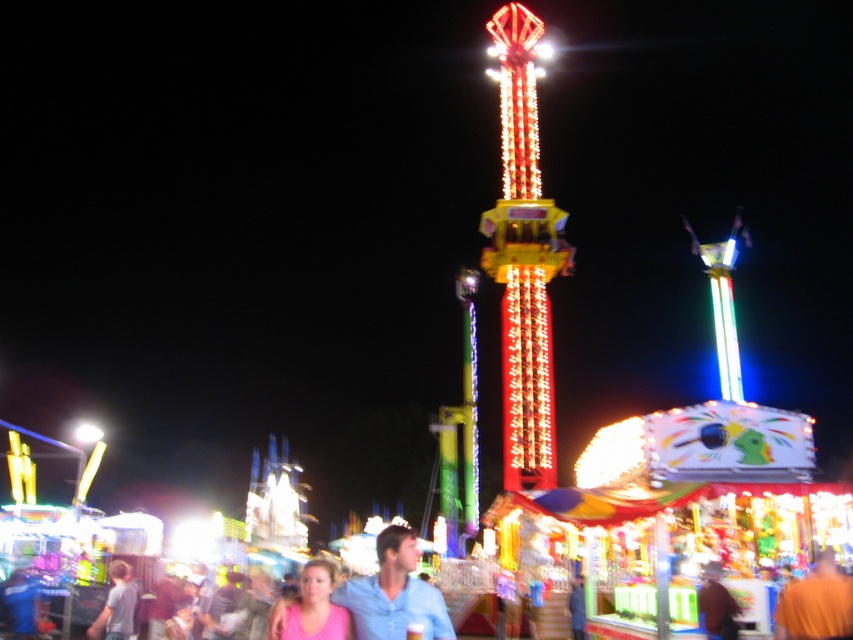
Question: Does pink matte shirt at lower center appear on the left side of light blue shirt at lower left?

Choices:
 (A) yes
 (B) no

Answer: (B)

Question: Among these objects, which one is farthest from the camera?

Choices:
 (A) pink matte shirt at lower center
 (B) blue cotton shirt at center
 (C) light blue shirt at lower left
 (D) orange cloth at center

Answer: (C)

Question: Which object appears farthest from the camera in this image?

Choices:
 (A) blue cotton shirt at center
 (B) pink matte shirt at lower center
 (C) orange cloth at center
 (D) light blue shirt at lower left

Answer: (D)

Question: Which of the following is the closest to the observer?

Choices:
 (A) pink matte shirt at lower center
 (B) light blue shirt at lower left

Answer: (A)

Question: Is blue cotton shirt at center closer to camera compared to pink matte shirt at lower center?

Choices:
 (A) no
 (B) yes

Answer: (B)

Question: Can you confirm if blue cotton shirt at center is positioned to the right of pink matte shirt at lower center?

Choices:
 (A) yes
 (B) no

Answer: (A)